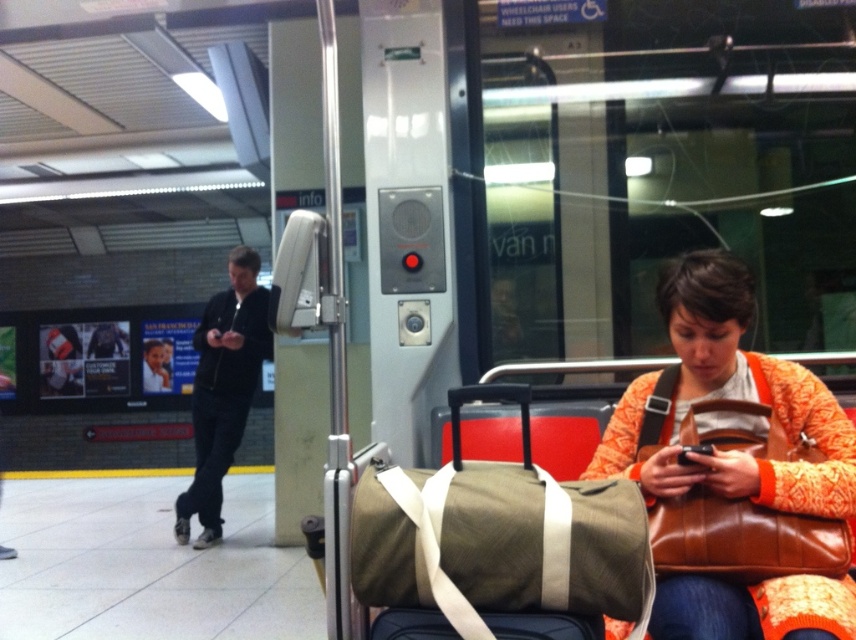
From the picture: Does orange textured sweater at lower right have a larger size compared to matte green duffel bag at center?

Yes, orange textured sweater at lower right is bigger than matte green duffel bag at center.

Does orange textured sweater at lower right appear on the left side of matte green duffel bag at center?

Incorrect, orange textured sweater at lower right is not on the left side of matte green duffel bag at center.

Is point (741, 282) more distant than point (444, 624)?

Yes, it is behind point (444, 624).

Image resolution: width=856 pixels, height=640 pixels. I want to click on orange textured sweater at lower right, so click(x=729, y=397).

Consider the image. Which is above, black zip-up jacket at left or matte green duffel bag at center?

black zip-up jacket at left is above.

Is point (254, 385) behind point (379, 636)?

Yes.

Which is in front, point (200, 544) or point (593, 620)?

Point (593, 620)

Where is `black zip-up jacket at left`? black zip-up jacket at left is located at coordinates (223, 388).

Is orange textured sweater at lower right further to the viewer compared to black zip-up jacket at left?

No, orange textured sweater at lower right is closer to the viewer.

Who is lower down, orange textured sweater at lower right or black zip-up jacket at left?

Positioned lower is black zip-up jacket at left.

Is point (675, 600) less distant than point (242, 323)?

Yes, point (675, 600) is closer to viewer.

Locate an element on the screen. This screenshot has height=640, width=856. orange textured sweater at lower right is located at coordinates (729, 397).